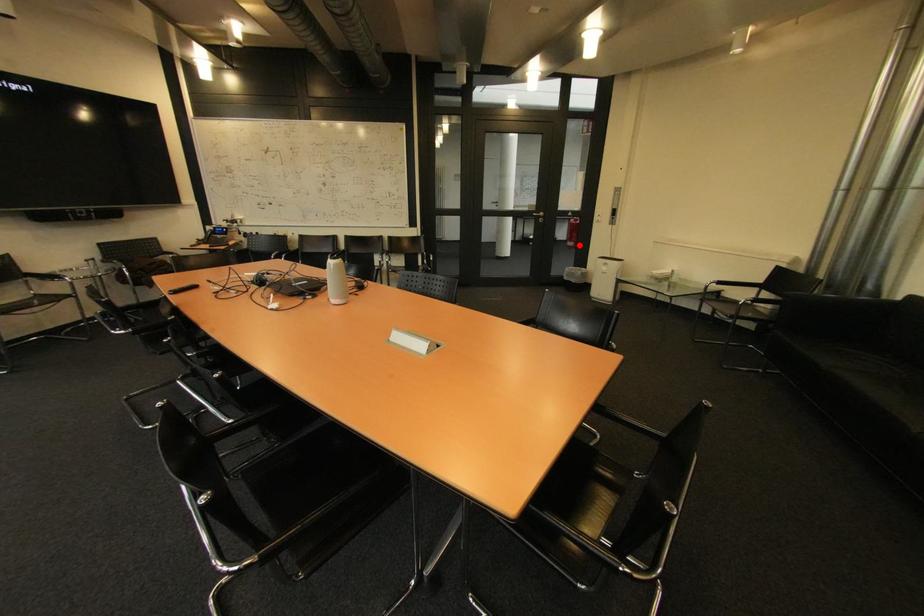
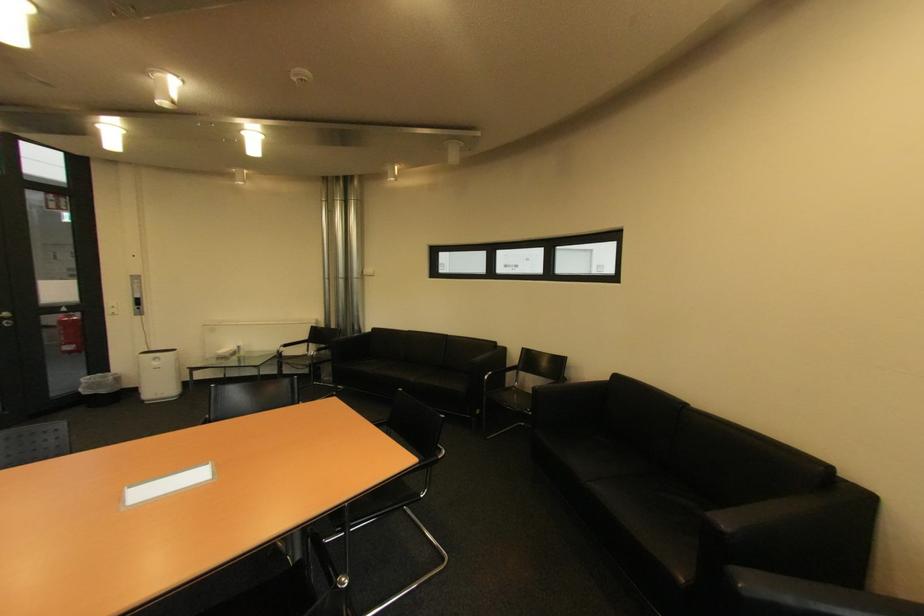
The point at the highlighted location is marked in the first image. Where is the corresponding point in the second image?

(79, 349)